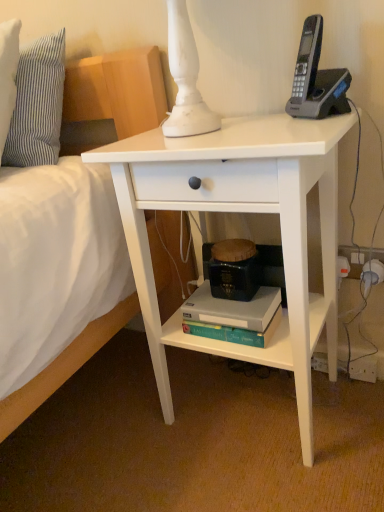
Where is `vacant space underneath white matte desk at center (from a real-world perspective)`? The width and height of the screenshot is (384, 512). vacant space underneath white matte desk at center (from a real-world perspective) is located at coordinates (248, 406).